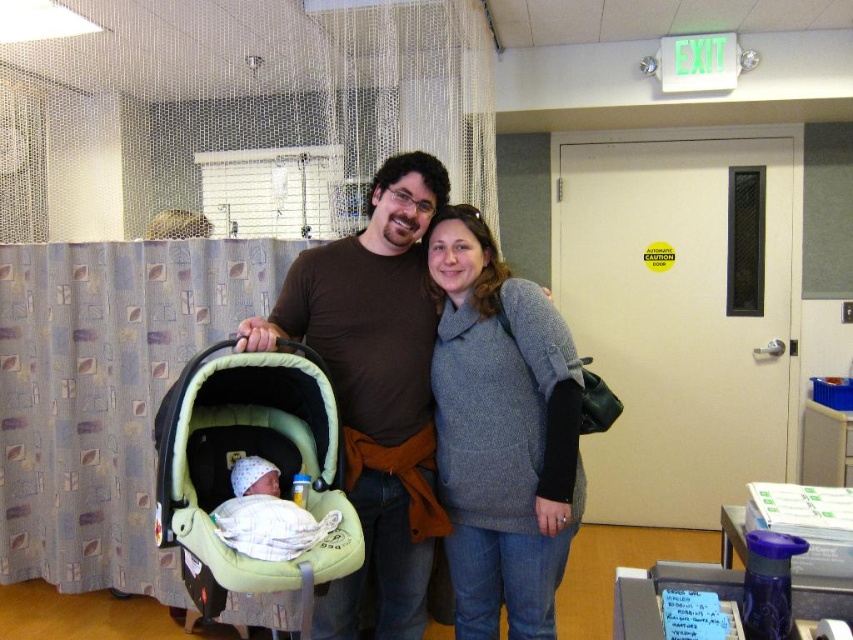
Question: From the image, what is the correct spatial relationship of green fabric baby carriage at center in relation to soft white swaddle at center?

Choices:
 (A) left
 (B) right

Answer: (A)

Question: Considering the relative positions of green fabric baby carriage at center and soft white swaddle at center in the image provided, where is green fabric baby carriage at center located with respect to soft white swaddle at center?

Choices:
 (A) above
 (B) below

Answer: (A)

Question: Is gray wool sweater at center bigger than green fabric baby carriage at center?

Choices:
 (A) no
 (B) yes

Answer: (B)

Question: Which is nearer to the green fabric baby carriage at center?

Choices:
 (A) gray wool sweater at center
 (B) soft white swaddle at center

Answer: (B)

Question: Which object appears farthest from the camera in this image?

Choices:
 (A) matte brown shirt at center
 (B) soft white swaddle at center

Answer: (A)

Question: Among these objects, which one is farthest from the camera?

Choices:
 (A) gray wool sweater at center
 (B) matte brown shirt at center
 (C) soft white swaddle at center
 (D) green fabric baby carriage at center

Answer: (A)